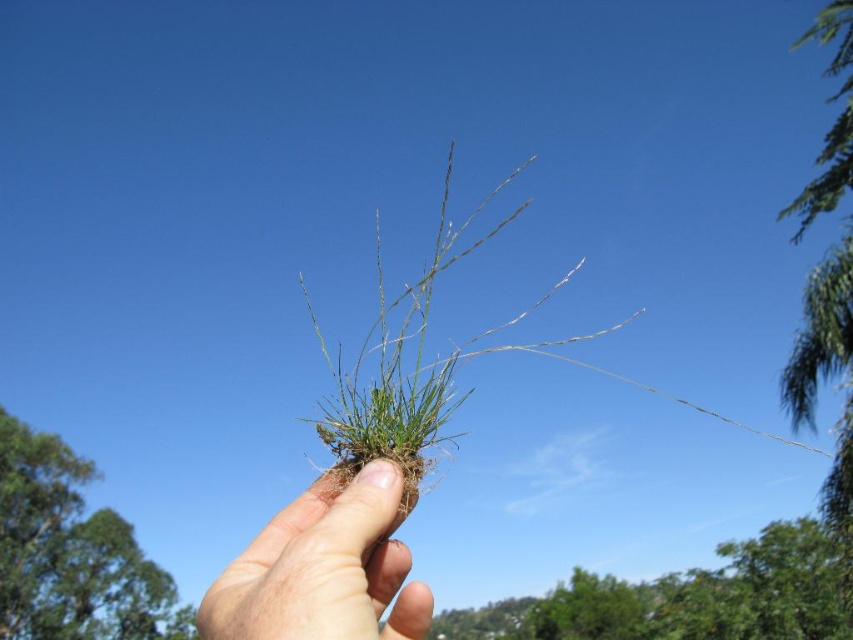
You are a photographer trying to capture a close detail of the plant. Which of the two points, point (808,598) or point (45,563), is closer to the camera and thus would be in focus if you focus on the nearest point?

Point (808,598) is closer to the camera than point (45,563), so focusing on it would ensure that point is in focus.

In the scene shown: You are standing in a garden where you see two green leafy trees. One is the green leafy tree at lower right and the other is the green leafy tree at upper left. Which tree is closer to the ground?

The green leafy tree at lower right is positioned under the green leafy tree at upper left, so it is closer to the ground.